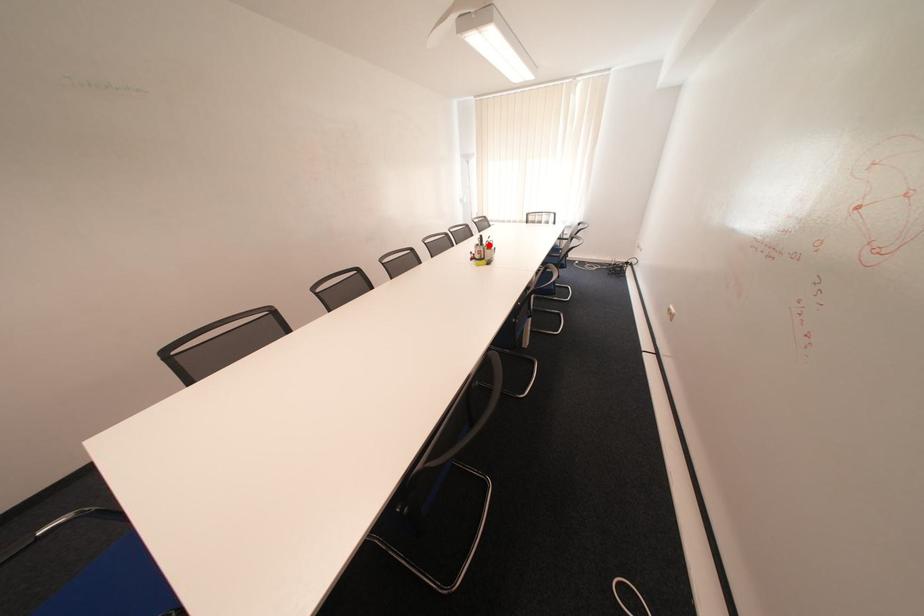
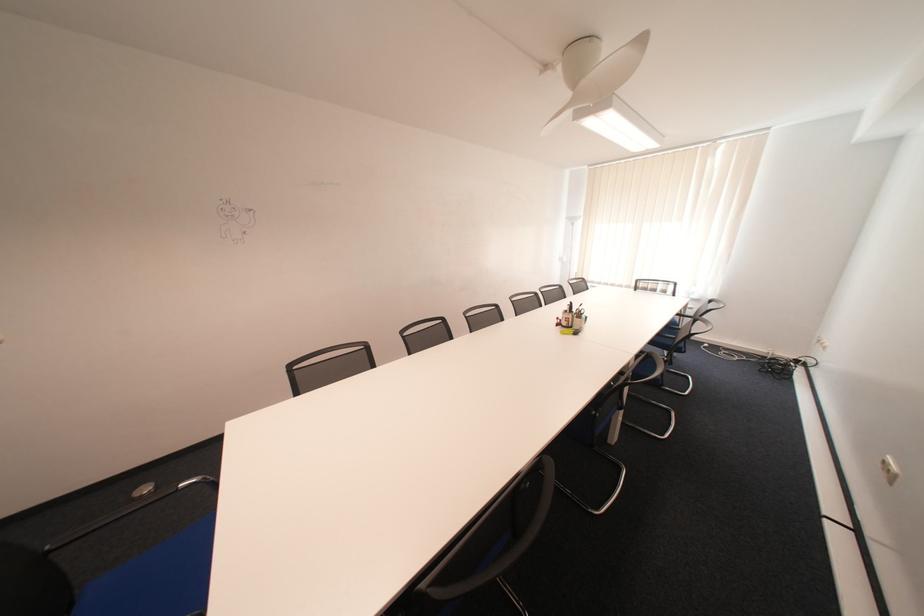
Where in the second image is the point corresponding to the highlighted location from the first image?

(578, 312)